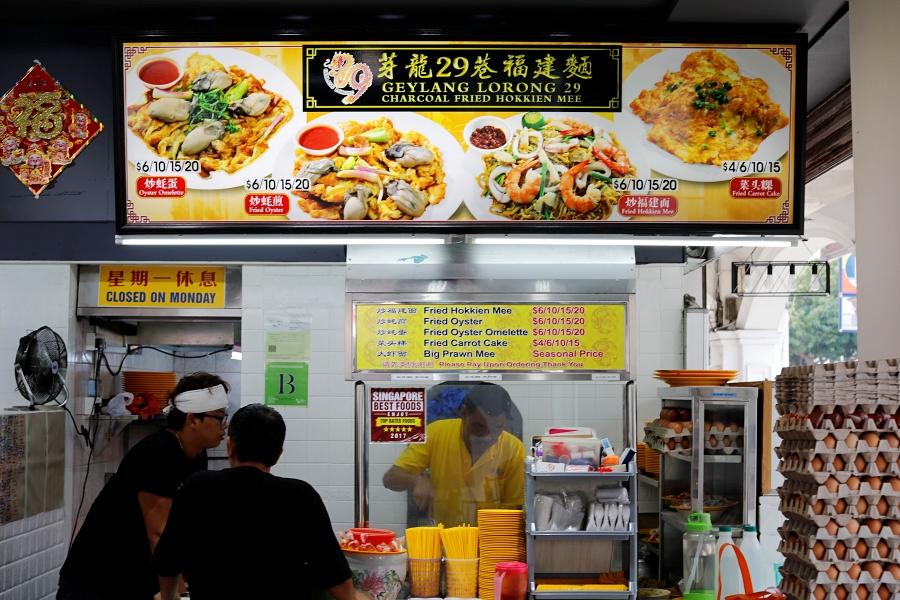
This screenshot has height=600, width=900. I want to click on compact fan, so click(x=55, y=350).